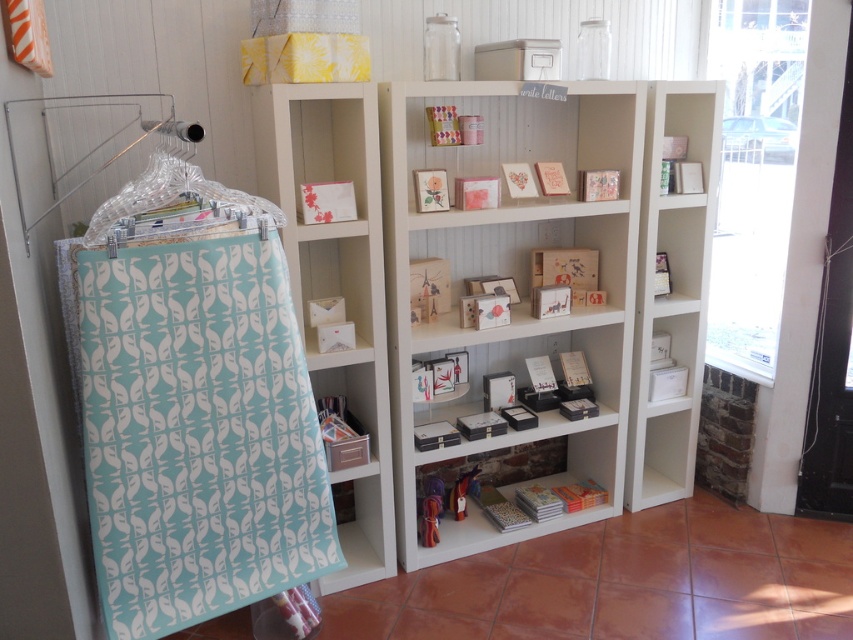
Question: Which object is farther from the camera taking this photo?

Choices:
 (A) white matte shelf at center
 (B) clear plastic hanger at left
 (C) white matte bookshelf at center

Answer: (C)

Question: Which point is closer to the camera?

Choices:
 (A) (398, 131)
 (B) (352, 490)

Answer: (A)

Question: Can you confirm if white matte bookshelf at center is positioned to the right of white matte shelf at right?

Choices:
 (A) yes
 (B) no

Answer: (B)

Question: Estimate the real-world distances between objects in this image. Which object is farther from the white matte shelf at right?

Choices:
 (A) white matte bookshelf at center
 (B) clear plastic hanger at left
 (C) white matte shelf at center

Answer: (B)

Question: Can you confirm if white matte bookshelf at center is bigger than white matte shelf at right?

Choices:
 (A) yes
 (B) no

Answer: (A)

Question: Can you confirm if white matte bookshelf at center is positioned to the right of white matte shelf at center?

Choices:
 (A) no
 (B) yes

Answer: (B)